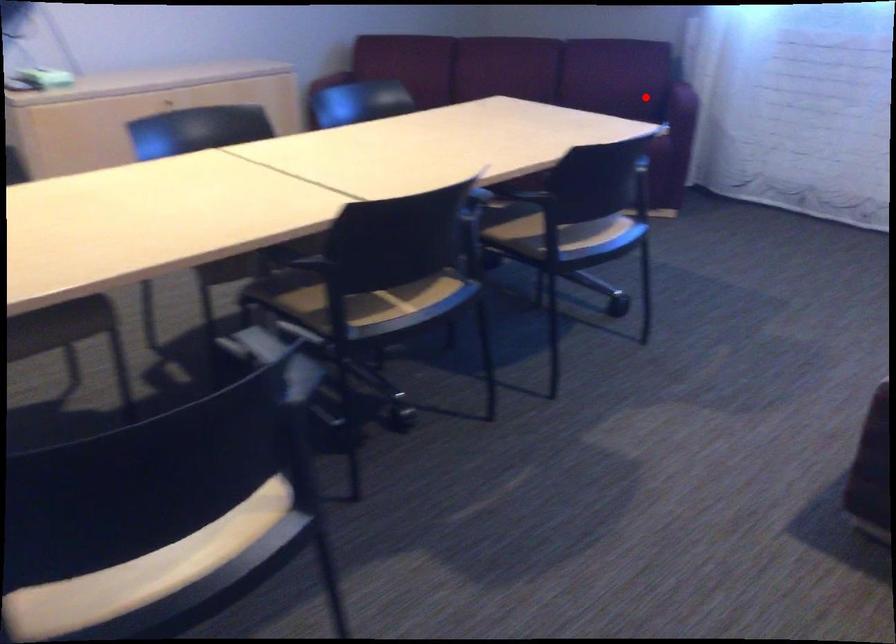
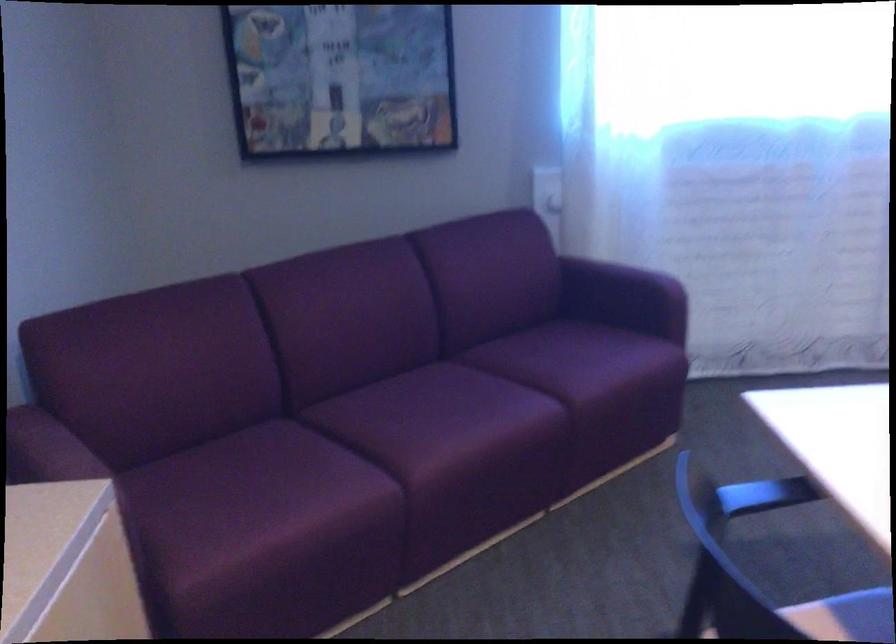
Question: I am providing you with two images of the same scene from different viewpoints. Image1 has a red point marked. In image2, the corresponding 3D location appears at what relative position? Reply with the corresponding letter.

Choices:
 (A) Closer
 (B) Farther

Answer: (A)